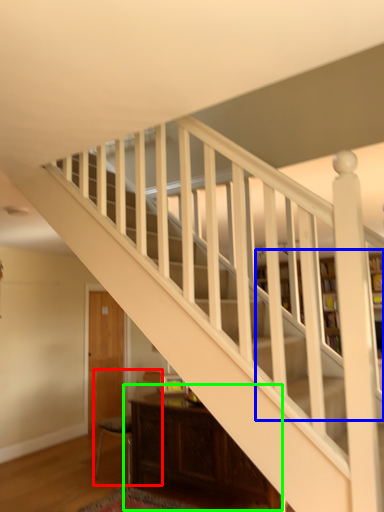
Question: Estimate the real-world distances between objects in this image. Which object is farther from armchair (highlighted by a red box), bookcase (highlighted by a blue box) or table (highlighted by a green box)?

Choices:
 (A) bookcase
 (B) table

Answer: (A)